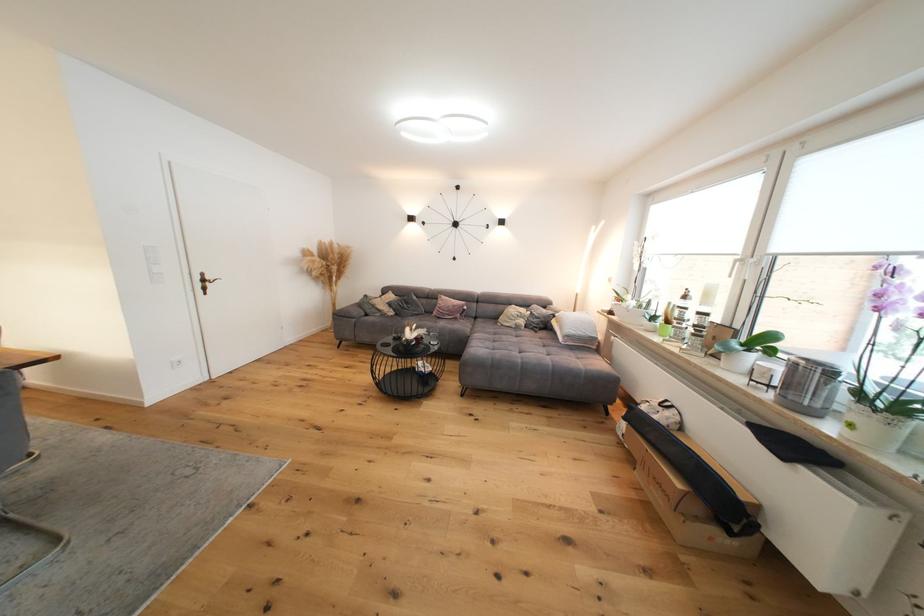
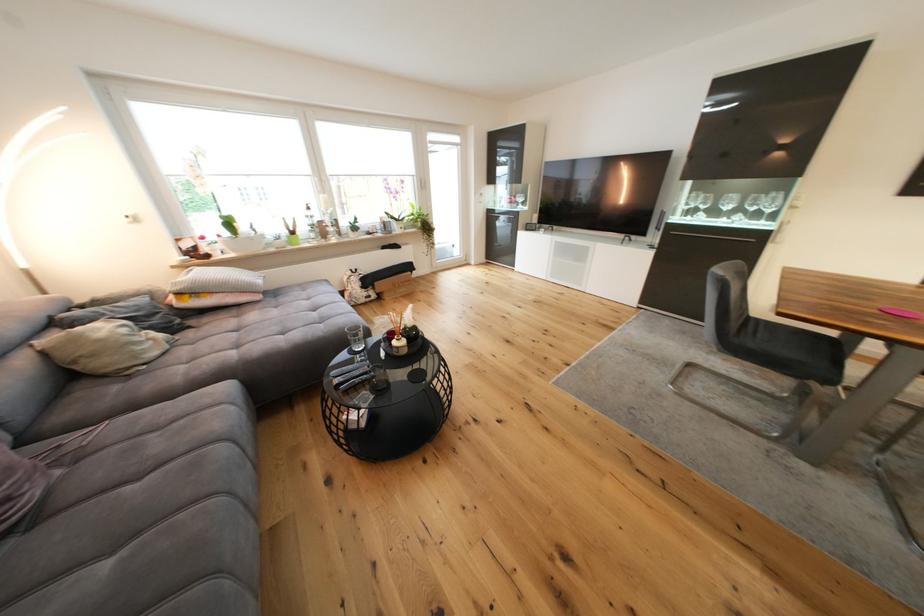
Find the pixel in the second image that matches pixel 529 323 in the first image.

(161, 336)